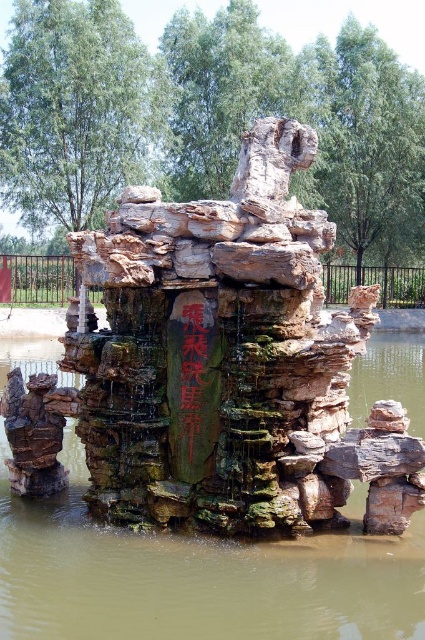
How much distance is there between rusty stone rock at left and black stone writing at center?

They are 6.14 meters apart.

Describe the element at coordinates (34, 433) in the screenshot. The height and width of the screenshot is (640, 425). I see `rusty stone rock at left` at that location.

Who is more forward, (10,461) or (189,320)?

Point (189,320)

Find the location of a particular element. The width and height of the screenshot is (425, 640). rusty stone rock at left is located at coordinates (34, 433).

Between green mossy rock at center and black stone writing at center, which one is positioned lower?

green mossy rock at center is below.

Does green mossy rock at center have a lesser height compared to black stone writing at center?

No, green mossy rock at center is not shorter than black stone writing at center.

What do you see at coordinates (198, 576) in the screenshot?
I see `green mossy rock at center` at bounding box center [198, 576].

Find the location of a particular element. This screenshot has height=640, width=425. green mossy rock at center is located at coordinates (198, 576).

Who is positioned more to the left, green mossy rock at center or rusty stone rock at left?

Positioned to the left is rusty stone rock at left.

From the picture: Does green mossy rock at center have a lesser height compared to rusty stone rock at left?

No, green mossy rock at center is not shorter than rusty stone rock at left.

Is point (23, 532) positioned before point (39, 404)?

Yes, point (23, 532) is closer to viewer.

At what (x,y) coordinates should I click in order to perform the action: click on green mossy rock at center. Please return your answer as a coordinate pair (x, y). The height and width of the screenshot is (640, 425). Looking at the image, I should click on (198, 576).